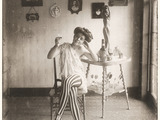
You are a GUI agent. You are given a task and a screenshot of the screen. Output one action in this format:
    pyautogui.click(x=<x>, y=<y>)
    Task: Click on the window
    This screenshot has height=120, width=160.
    Given the screenshot: What is the action you would take?
    pyautogui.click(x=154, y=73)